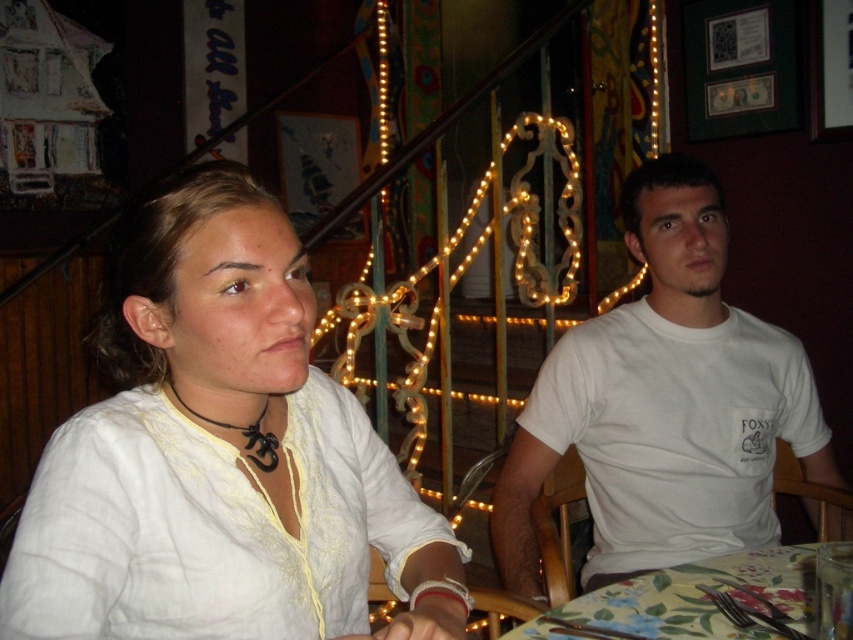
Consider the image. You are a photographer trying to capture a candid shot of the white cotton shirt at upper left without including the floral fabric tablecloth at lower center in the frame. Is this possible given their positions?

The white cotton shirt at upper left is in front of the floral fabric tablecloth at lower center, so you can position the camera to focus on the white cotton shirt at upper left while angling the shot to exclude the floral fabric tablecloth at lower center from the frame.